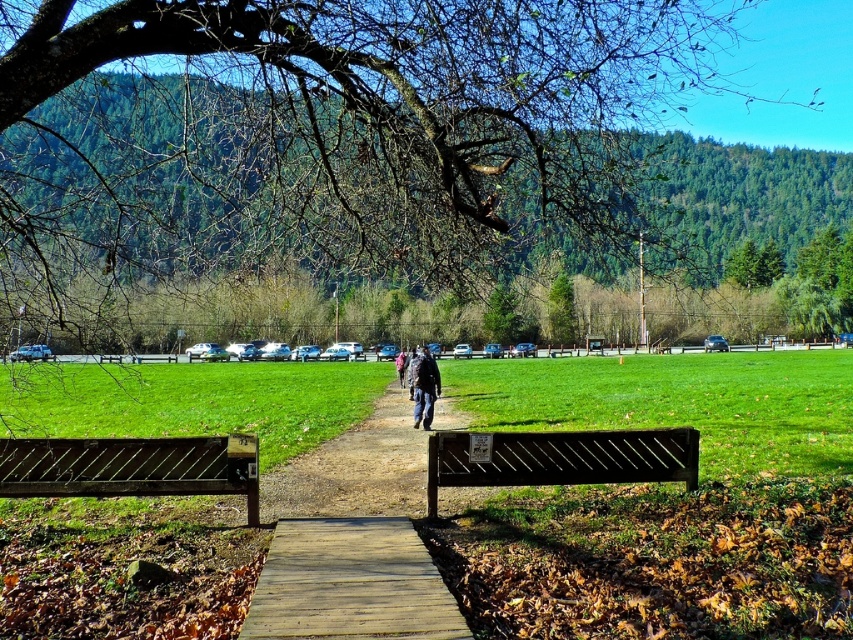
Question: Is rustic wood bench at center bigger than dark brown wooden bench at center?

Choices:
 (A) yes
 (B) no

Answer: (B)

Question: Is wooden boardwalk at center closer to camera compared to dark brown wooden bench at center?

Choices:
 (A) yes
 (B) no

Answer: (A)

Question: Which of these objects is positioned closest to the rustic wood bench at center?

Choices:
 (A) brown wooden bench at center
 (B) bare branches at upper center
 (C) dark brown wooden bench at center

Answer: (C)

Question: Can you confirm if bare branches at upper center is bigger than brown wooden bench at center?

Choices:
 (A) yes
 (B) no

Answer: (A)

Question: Which object is the closest to the brown wooden bench at center?

Choices:
 (A) dark brown wooden bench at center
 (B) rustic wood bench at center
 (C) wooden boardwalk at center

Answer: (C)

Question: Which of these objects is positioned farthest from the rustic wood bench at center?

Choices:
 (A) bare branches at upper center
 (B) dark blue jacket at center
 (C) brown wooden bench at center

Answer: (B)